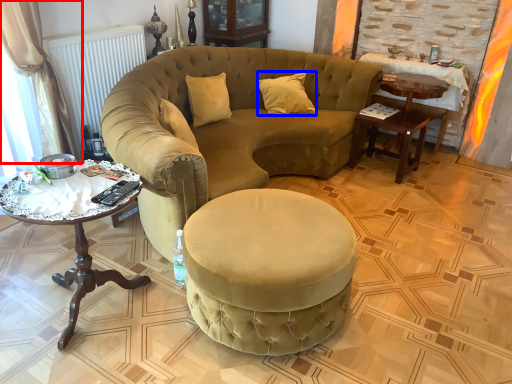
Question: Which of the following is the farthest to the observer, curtain (highlighted by a red box) or pillow (highlighted by a blue box)?

Choices:
 (A) curtain
 (B) pillow

Answer: (B)